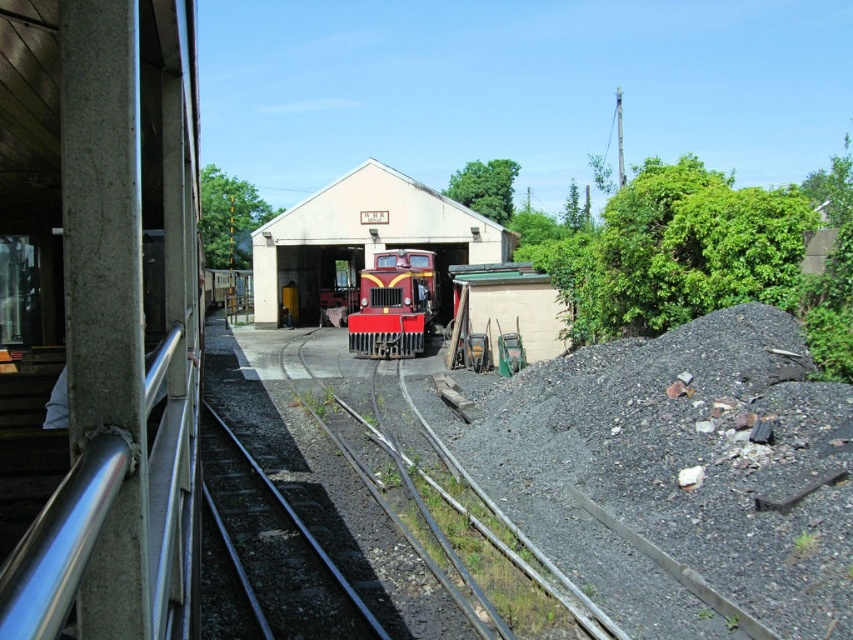
The height and width of the screenshot is (640, 853). What do you see at coordinates (694, 460) in the screenshot?
I see `gray gravel at lower right` at bounding box center [694, 460].

Does point (578, 371) come farther from viewer compared to point (326, 225)?

No, (578, 371) is closer to viewer.

You are a GUI agent. You are given a task and a screenshot of the screen. Output one action in this format:
    pyautogui.click(x=<x>, y=<y>)
    Task: Click on the gray gravel at lower right
    
    Given the screenshot: What is the action you would take?
    pyautogui.click(x=694, y=460)

Does point (746, 486) come behind point (352, 349)?

No, (746, 486) is in front of (352, 349).

Can you confirm if gray gravel at lower right is wider than shiny red locomotive at center?

In fact, gray gravel at lower right might be narrower than shiny red locomotive at center.

Is point (850, 612) positioned behind point (396, 284)?

No, it is not.

Where is `gray gravel at lower right`? This screenshot has width=853, height=640. gray gravel at lower right is located at coordinates pyautogui.click(x=694, y=460).

In the scene shown: Which is more to the right, matte red train at center or shiny red locomotive at center?

shiny red locomotive at center

In order to click on matte red train at center in this screenshot , I will do `click(363, 240)`.

I want to click on matte red train at center, so click(363, 240).